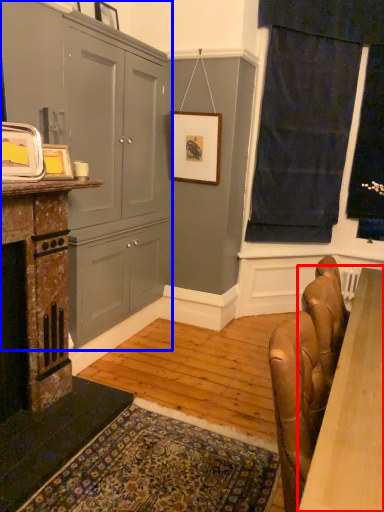
Question: Which object appears farthest to the camera in this image, table (highlighted by a red box) or cabinetry (highlighted by a blue box)?

Choices:
 (A) table
 (B) cabinetry

Answer: (B)